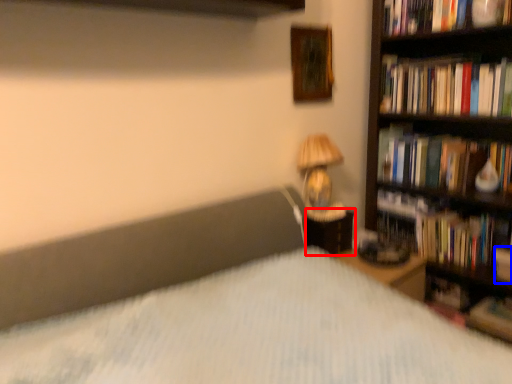
Question: Which object is further to the camera taking this photo, nightstand (highlighted by a red box) or paperback book (highlighted by a blue box)?

Choices:
 (A) nightstand
 (B) paperback book

Answer: (A)